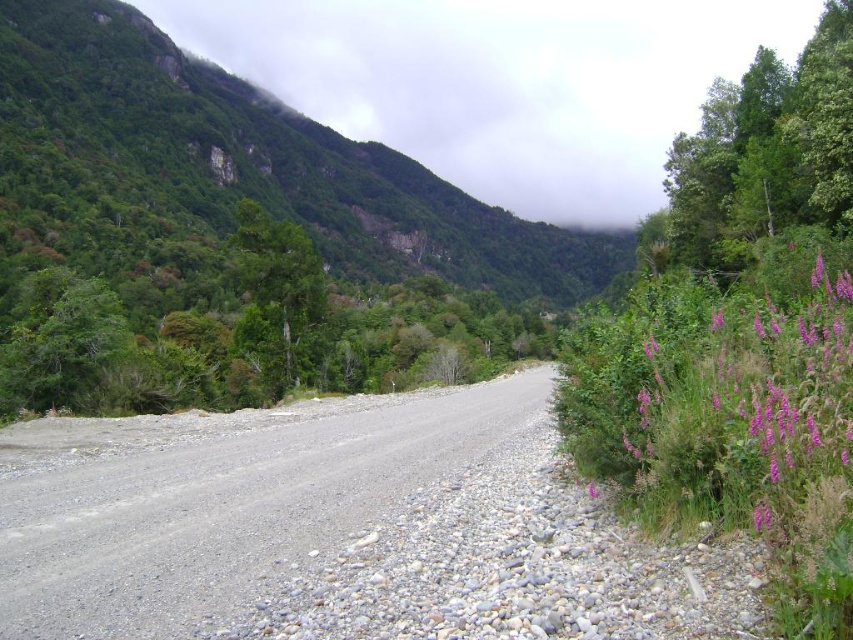
Describe the element at coordinates (227, 509) in the screenshot. I see `gray gravel road at center` at that location.

Is gray gravel road at center closer to the viewer compared to purple fuzzy flowers at right?

No, it is behind purple fuzzy flowers at right.

Where is `gray gravel road at center`? This screenshot has height=640, width=853. gray gravel road at center is located at coordinates (227, 509).

You are a GUI agent. You are given a task and a screenshot of the screen. Output one action in this format:
    pyautogui.click(x=<x>, y=<y>)
    Task: Click on the gray gravel road at center
    
    Given the screenshot: What is the action you would take?
    pyautogui.click(x=227, y=509)

Can you confirm if green matte rock at upper center is shorter than gray gravel road at center?

In fact, green matte rock at upper center may be taller than gray gravel road at center.

Is green matte rock at upper center below gray gravel road at center?

Actually, green matte rock at upper center is above gray gravel road at center.

What do you see at coordinates (500, 83) in the screenshot? This screenshot has height=640, width=853. I see `green matte rock at upper center` at bounding box center [500, 83].

Identify the location of green matte rock at upper center. The image size is (853, 640). (500, 83).

Between green matte rock at upper center and purple fuzzy flowers at right, which one has more height?

green matte rock at upper center is taller.

Which is above, green matte rock at upper center or purple fuzzy flowers at right?

green matte rock at upper center is higher up.

Between point (258, 81) and point (843, 301), which one is positioned in front?

Positioned in front is point (843, 301).

The image size is (853, 640). What are the coordinates of `green matte rock at upper center` in the screenshot? It's located at (500, 83).